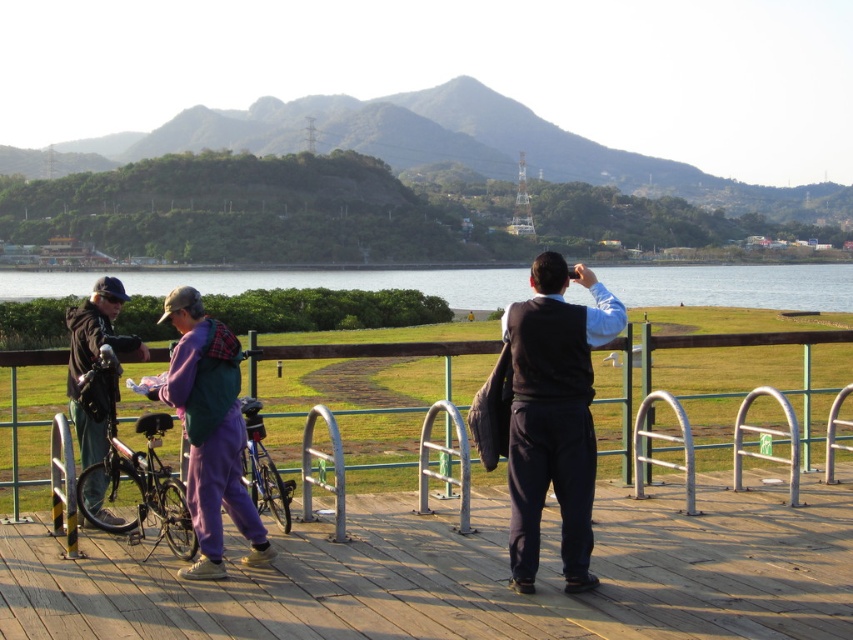
Question: Is clear water at center wider than dark gray jacket at left?

Choices:
 (A) no
 (B) yes

Answer: (B)

Question: Estimate the real-world distances between objects in this image. Which object is closer to the dark gray jacket at left?

Choices:
 (A) green metal fence at center
 (B) wooden at center

Answer: (A)

Question: Is clear water at center to the right of dark gray jacket at left from the viewer's perspective?

Choices:
 (A) yes
 (B) no

Answer: (A)

Question: Is shiny metallic bicycle at left above blue metallic bicycle at center?

Choices:
 (A) yes
 (B) no

Answer: (B)

Question: Among these objects, which one is farthest from the camera?

Choices:
 (A) dark blue suit at center
 (B) shiny metallic bicycle at left
 (C) green metal fence at center
 (D) blue metallic bicycle at center

Answer: (C)

Question: Which point is farther to the camera?

Choices:
 (A) wooden at center
 (B) clear water at center

Answer: (B)